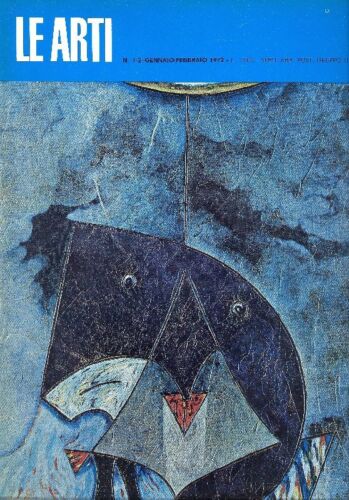
Identify the location of painting image. This screenshot has width=349, height=500. (143, 178).